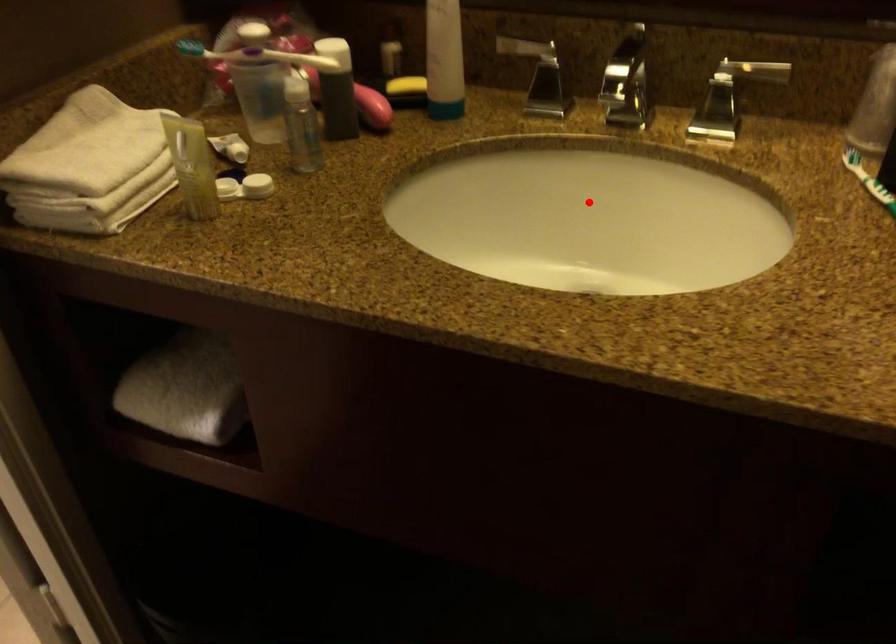
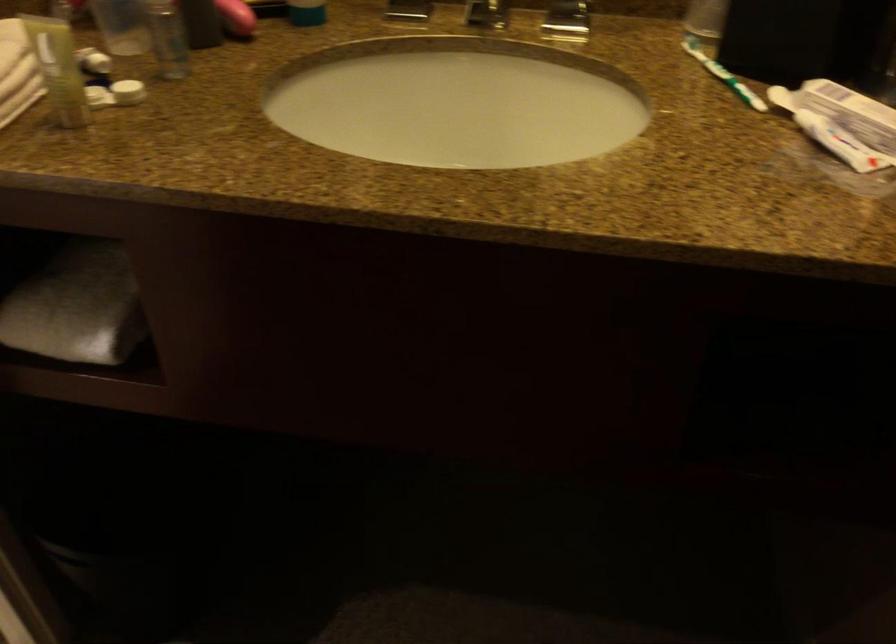
Find the pixel in the second image that matches the highlighted location in the first image.

(457, 102)